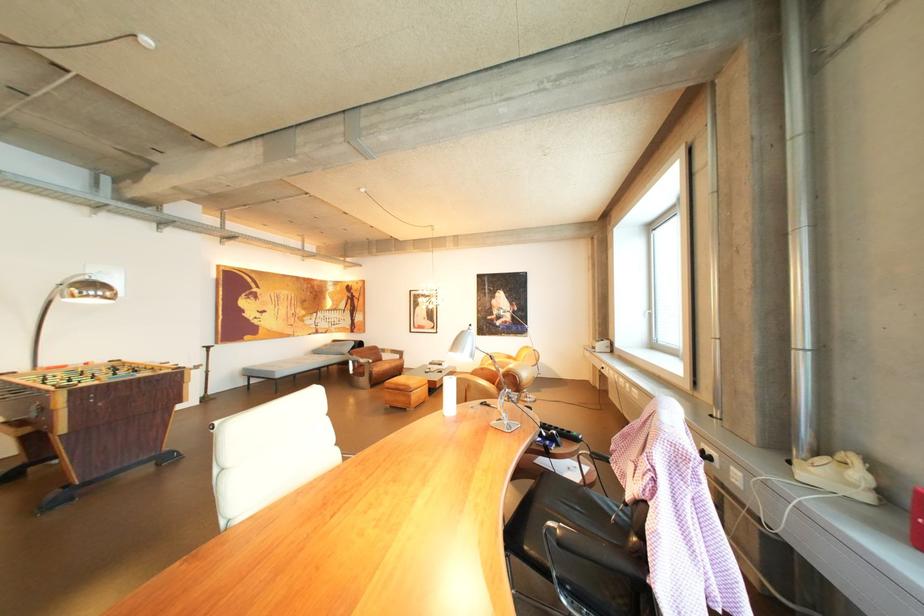
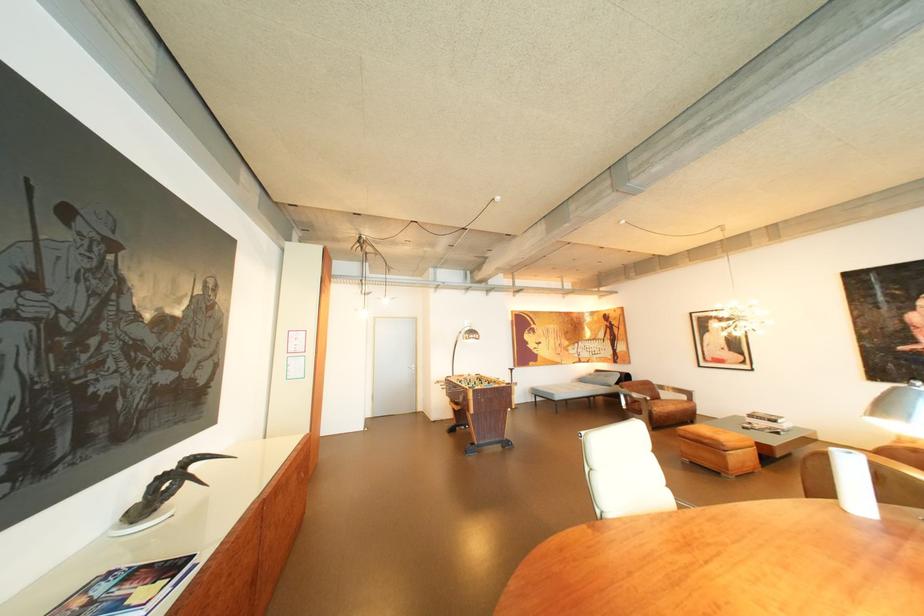
The point at (375, 360) is marked in the first image. Where is the corresponding point in the second image?

(649, 395)